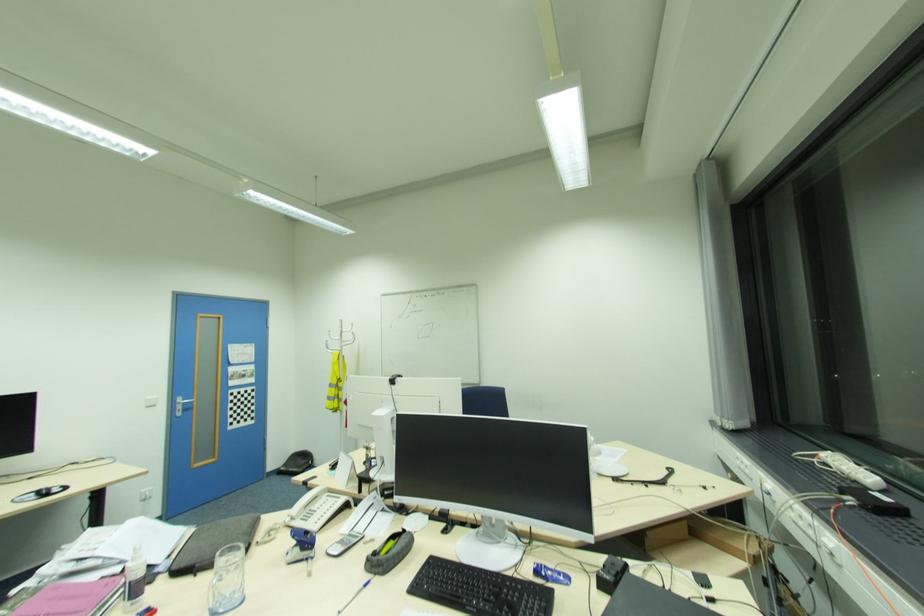
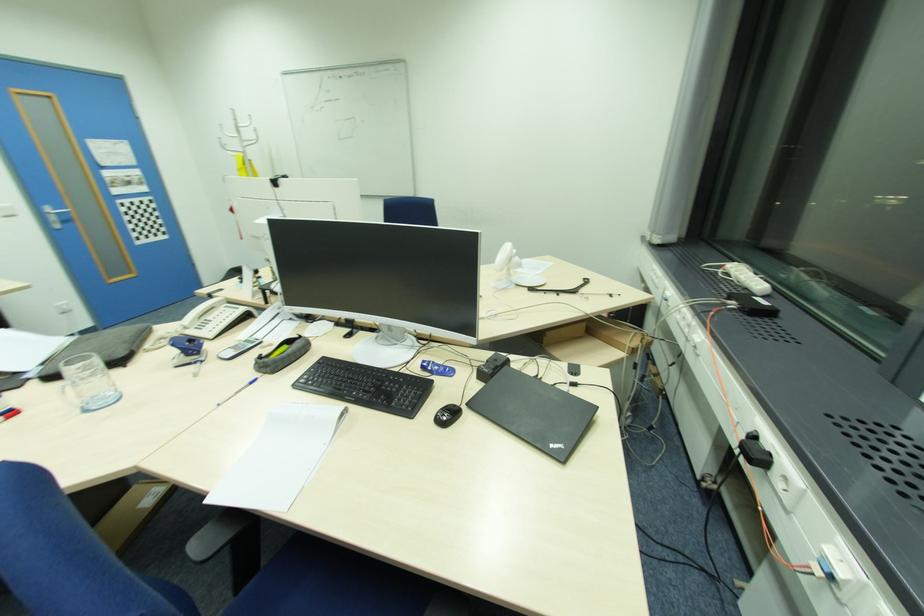
Where in the second image is the point corresponding to [181,403] from the first image?

(54, 213)